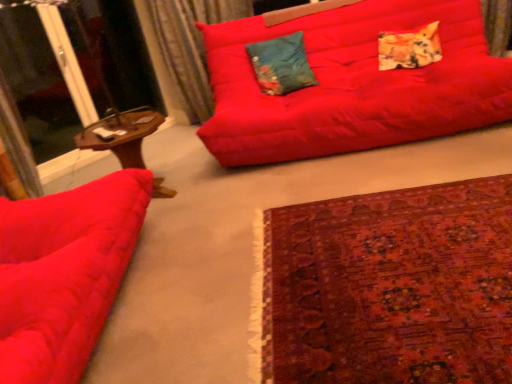
At what (x,y) coordinates should I click in order to perform the action: click on free space in front of woodenwoodentable at left. Please return your answer as a coordinate pair (x, y). Looking at the image, I should click on (173, 226).